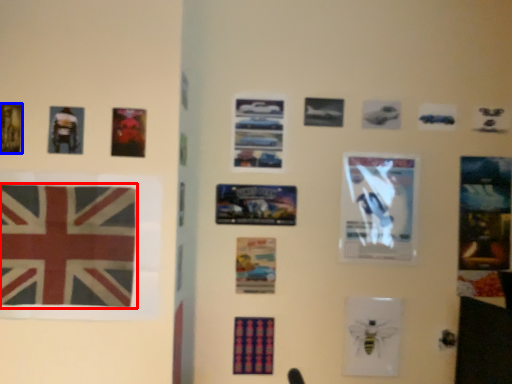
Question: Which of the following is the farthest to the observer, flag (highlighted by a red box) or poster (highlighted by a blue box)?

Choices:
 (A) flag
 (B) poster

Answer: (B)